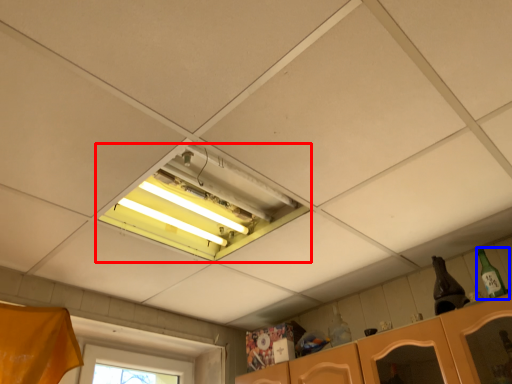
Question: Which point is further to the camera, window (highlighted by a red box) or bottle (highlighted by a blue box)?

Choices:
 (A) window
 (B) bottle

Answer: (B)